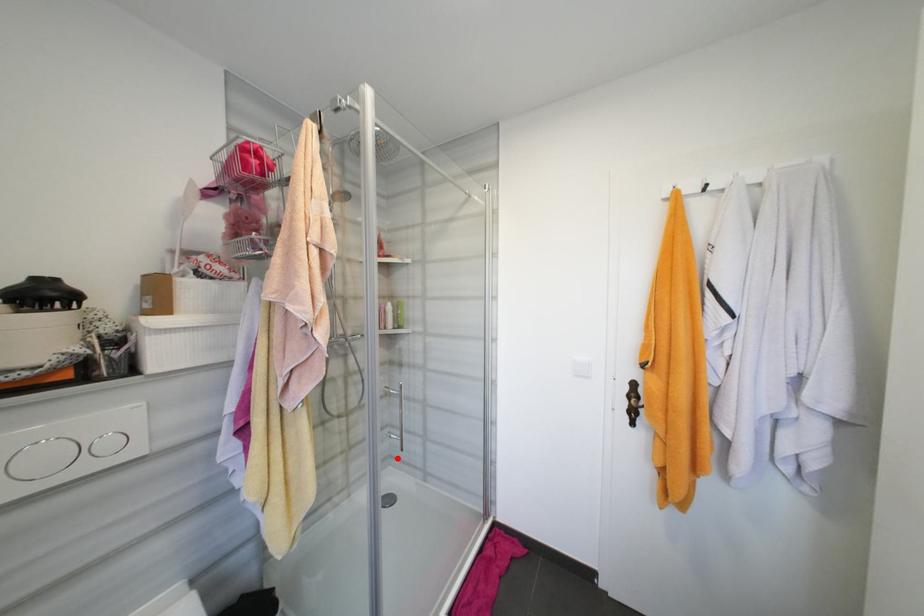
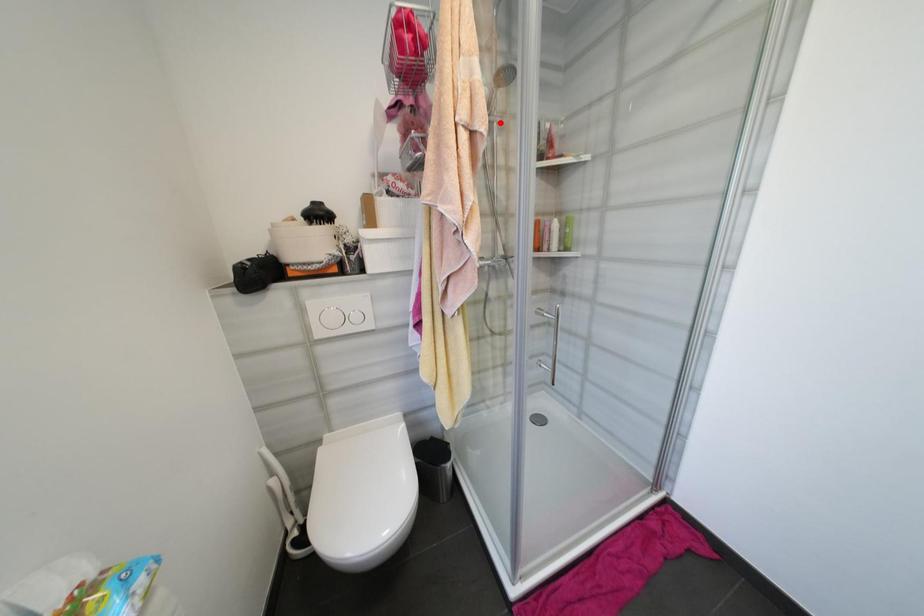
I am providing you with two images of the same scene from different viewpoints. A red point is marked on the first image and another point is marked on the second image. Do the highlighted points in image1 and image2 indicate the same real-world spot?

No